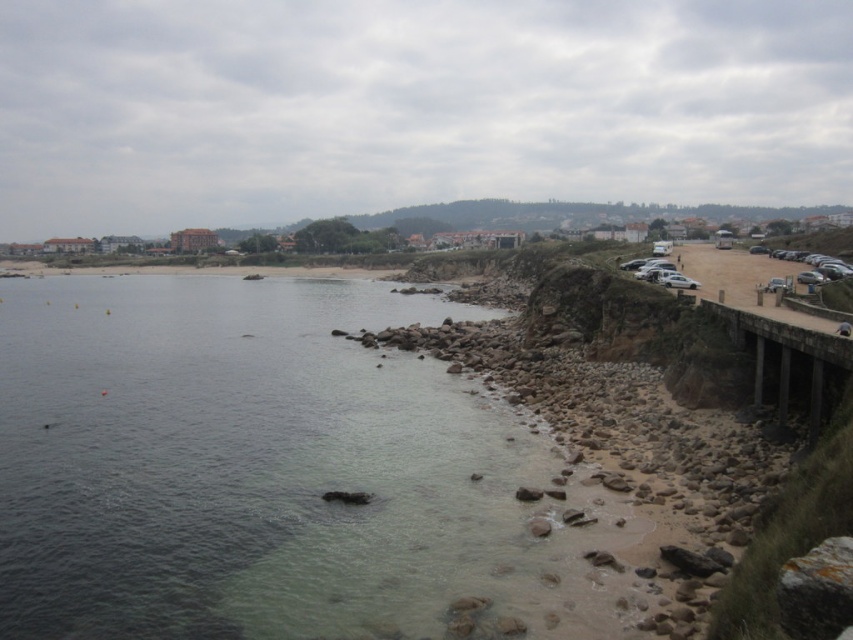
You are a swimmer planning to swim from the clear water at lower left to the concrete bridge at right. Which direction should you swim to reach the bridge?

The clear water at lower left is larger in size than the concrete bridge at right, so you should swim towards the right to reach the concrete bridge at right.